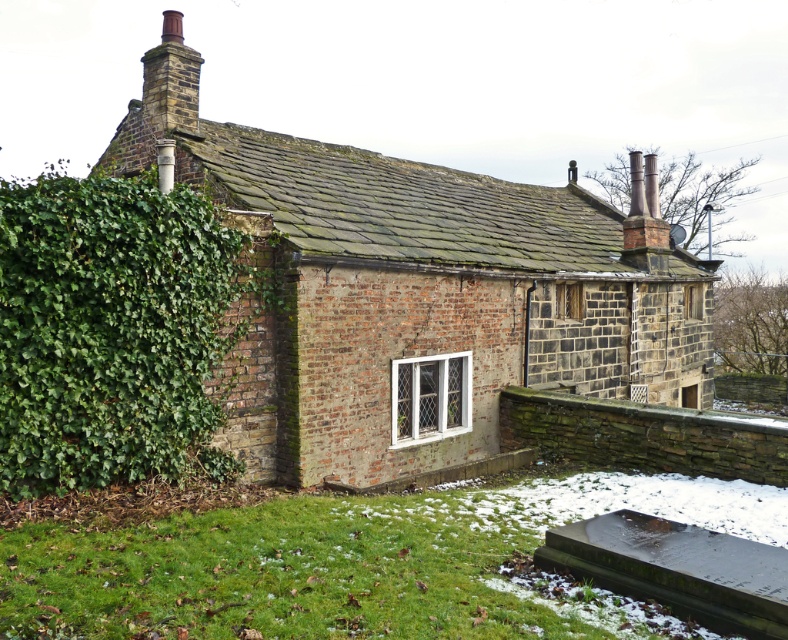
Is brown brick cottage at center wider than green leafy hedge at left?

Indeed, brown brick cottage at center has a greater width compared to green leafy hedge at left.

Is point (288, 282) positioned in front of point (147, 298)?

No.

What are the coordinates of `brown brick cottage at center` in the screenshot? It's located at (419, 291).